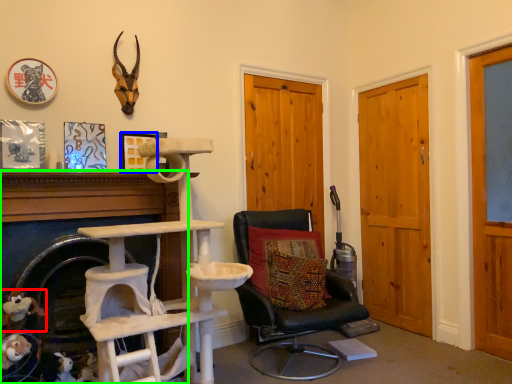
Question: Which object is positioned farthest from toy (highlighted by a red box)? Select from picture frame (highlighted by a blue box) and fireplace (highlighted by a green box).

Choices:
 (A) picture frame
 (B) fireplace

Answer: (A)